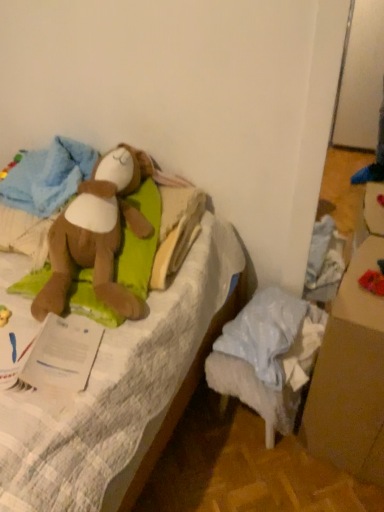
The height and width of the screenshot is (512, 384). Find the location of `vacant space that is to the left of red fabric toy at lower right, the first toy in the right-to-left sequence`. vacant space that is to the left of red fabric toy at lower right, the first toy in the right-to-left sequence is located at coordinates (350, 294).